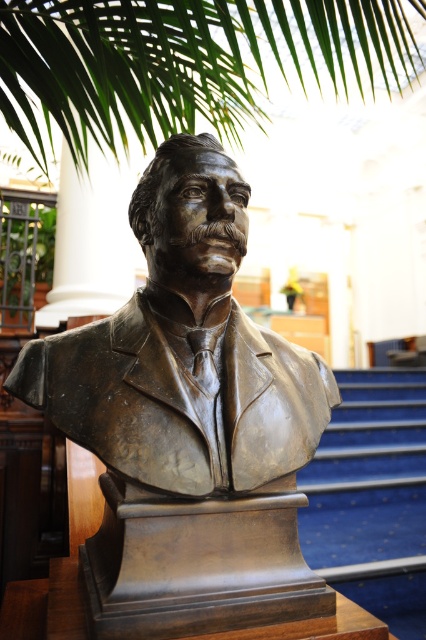
Who is positioned more to the left, bronze bust at center or blue carpet at center?

Positioned to the left is bronze bust at center.

Is point (166, 433) farther from camera compared to point (362, 442)?

No, (166, 433) is in front of (362, 442).

Who is more distant from viewer, (230,296) or (321,512)?

Positioned behind is point (321,512).

Where is `bronze bust at center`? Image resolution: width=426 pixels, height=640 pixels. bronze bust at center is located at coordinates (189, 420).